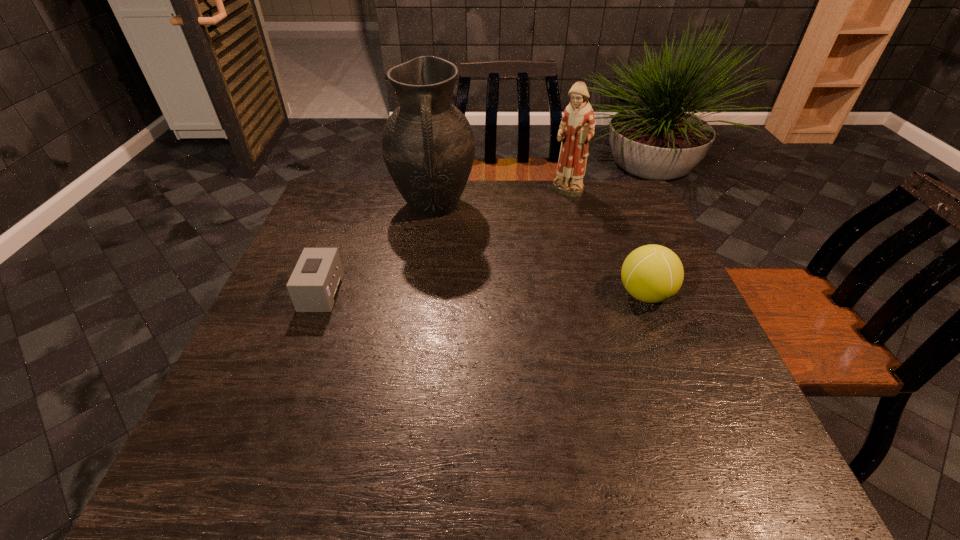
Locate an element on the screen. The height and width of the screenshot is (540, 960). the shortest object is located at coordinates (315, 282).

This screenshot has width=960, height=540. What are the coordinates of `the leftmost object` in the screenshot? It's located at (315, 282).

Find the location of a particular element. the second shortest object is located at coordinates (652, 273).

Locate an element on the screen. The width and height of the screenshot is (960, 540). the second tallest object is located at coordinates [x=577, y=126].

This screenshot has width=960, height=540. I want to click on the third object from right to left, so click(x=428, y=146).

Locate an element on the screen. This screenshot has height=540, width=960. the tallest object is located at coordinates (428, 146).

The width and height of the screenshot is (960, 540). Identify the location of vacant region located 0.190m on the back of the tennis ball. (620, 232).

Locate an element on the screen. Image resolution: width=960 pixels, height=540 pixels. vacant space located on the front-facing side of the figurine is located at coordinates (542, 247).

In order to click on free spot located 0.390m on the front-facing side of the figurine in this screenshot , I will do `click(526, 281)`.

Locate an element on the screen. The width and height of the screenshot is (960, 540). vacant space situated 0.300m on the front-facing side of the figurine is located at coordinates (537, 260).